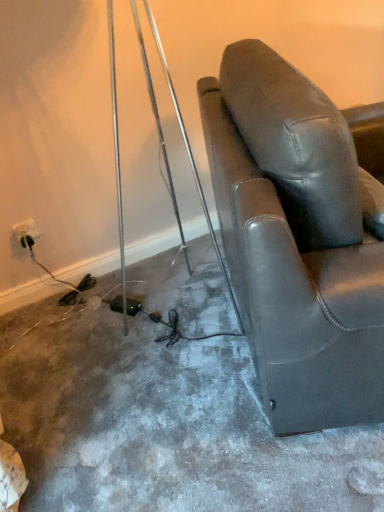
Question: Does matte black leather chair at right touch white plastic outlet at lower left?

Choices:
 (A) no
 (B) yes

Answer: (A)

Question: Does matte black leather chair at right appear on the right side of white plastic outlet at lower left?

Choices:
 (A) yes
 (B) no

Answer: (A)

Question: Could you tell me if matte black leather chair at right is facing white plastic outlet at lower left?

Choices:
 (A) no
 (B) yes

Answer: (A)

Question: Is matte black leather chair at right not inside white plastic outlet at lower left?

Choices:
 (A) no
 (B) yes

Answer: (B)

Question: From the image's perspective, is matte black leather chair at right above white plastic outlet at lower left?

Choices:
 (A) yes
 (B) no

Answer: (A)

Question: Can you confirm if matte black leather chair at right is shorter than white plastic outlet at lower left?

Choices:
 (A) no
 (B) yes

Answer: (A)

Question: Does white plastic outlet at lower left have a greater height compared to matte black leather chair at right?

Choices:
 (A) no
 (B) yes

Answer: (A)

Question: From the image's perspective, does white plastic outlet at lower left appear higher than matte black leather chair at right?

Choices:
 (A) yes
 (B) no

Answer: (B)

Question: From a real-world perspective, is white plastic outlet at lower left on top of matte black leather chair at right?

Choices:
 (A) yes
 (B) no

Answer: (B)

Question: Is white plastic outlet at lower left facing away from matte black leather chair at right?

Choices:
 (A) no
 (B) yes

Answer: (A)

Question: Is the position of white plastic outlet at lower left less distant than that of matte black leather chair at right?

Choices:
 (A) yes
 (B) no

Answer: (B)

Question: Considering the relative positions of white plastic outlet at lower left and matte black leather chair at right in the image provided, is white plastic outlet at lower left to the left of matte black leather chair at right from the viewer's perspective?

Choices:
 (A) no
 (B) yes

Answer: (B)

Question: Considering their positions, is matte black leather chair at right located in front of or behind white plastic outlet at lower left?

Choices:
 (A) behind
 (B) front

Answer: (B)